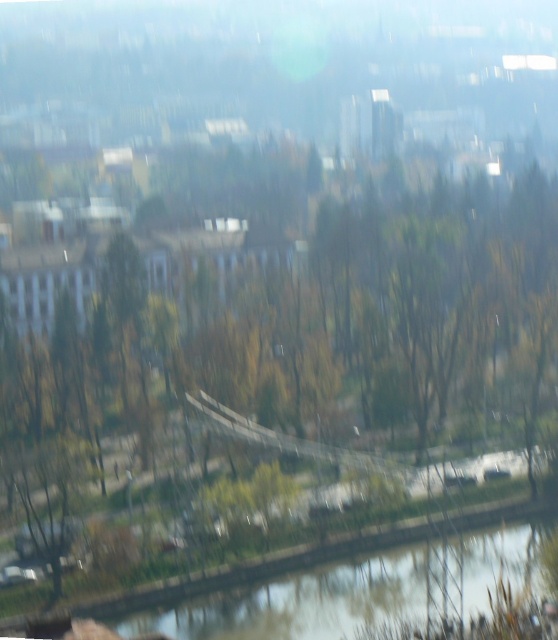
Who is positioned more to the right, brown leafy tree at center or green grassy river at bottom?

From the viewer's perspective, green grassy river at bottom appears more on the right side.

Who is positioned more to the left, brown leafy tree at center or green grassy river at bottom?

From the viewer's perspective, brown leafy tree at center appears more on the left side.

This screenshot has height=640, width=558. Find the location of `brown leafy tree at center`. brown leafy tree at center is located at coordinates (283, 362).

Locate an element on the screen. The width and height of the screenshot is (558, 640). brown leafy tree at center is located at coordinates (283, 362).